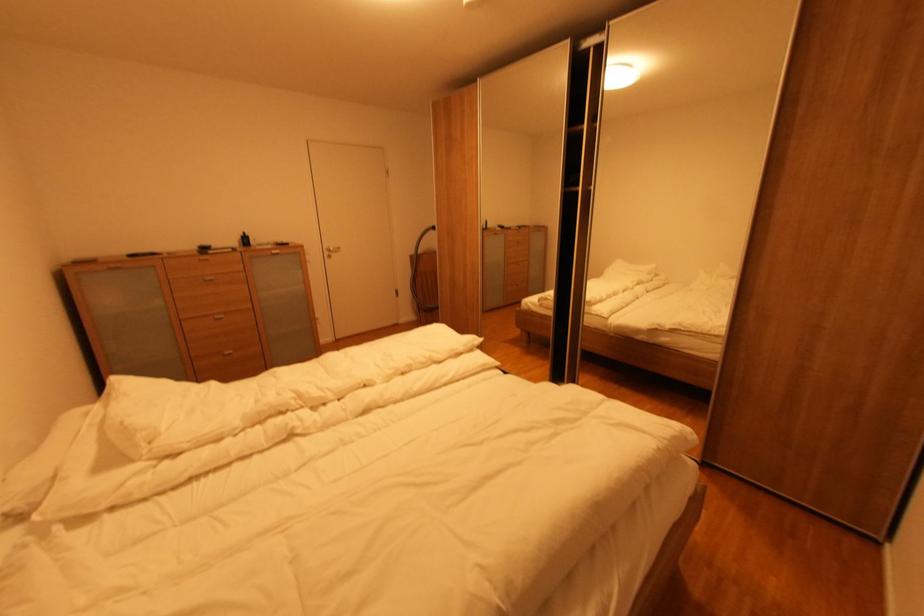
This screenshot has height=616, width=924. Describe the element at coordinates (334, 254) in the screenshot. I see `the white door handle` at that location.